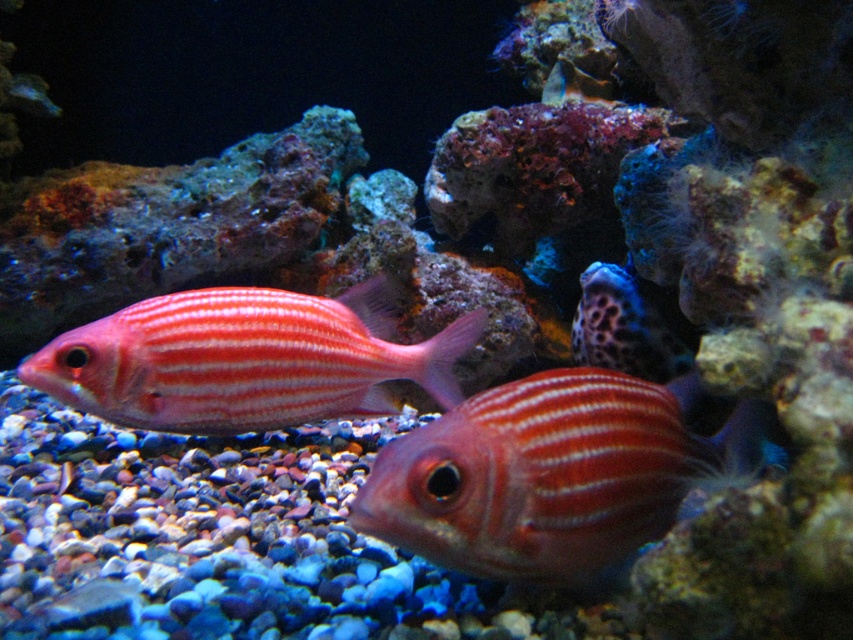
You are a marine biologist studying underwater life. You observe a shiny red fish at center in the image. Where exactly is this fish located in relation to the point marked at coordinates (552, 474)?

The point at coordinates (552, 474) corresponds exactly to the location of the shiny red fish at center, so the fish is precisely at that point.

You are a marine biologist observing two fish in an underwater scene. You notice a shiny red fish at center and a shiny pink fish at center. Which fish is positioned lower in the water?

The shiny red fish at center is located below the shiny pink fish at center, so it is positioned lower in the water.

You are a marine biologist observing two fish in an underwater scene. You notice a shiny red fish at center and a shiny pink fish at center. Which fish is positioned to the right of the other?

The shiny red fish at center is to the right of the shiny pink fish at center.